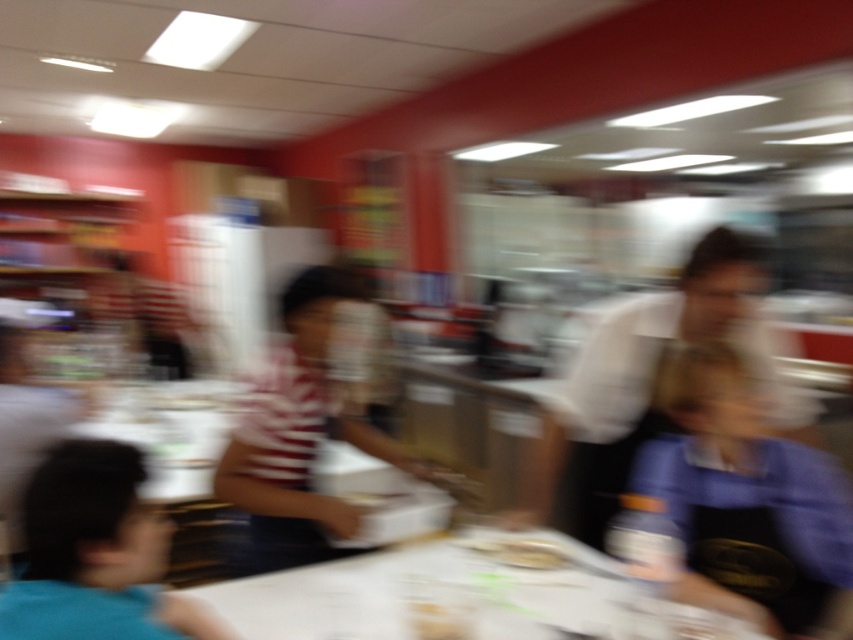
Which of these two, blue fabric shirt at right or white matte shirt at center, stands taller?

white matte shirt at center is taller.

Is blue fabric shirt at right behind white matte shirt at center?

No, blue fabric shirt at right is closer to the viewer.

What do you see at coordinates (737, 508) in the screenshot? This screenshot has width=853, height=640. I see `blue fabric shirt at right` at bounding box center [737, 508].

You are a GUI agent. You are given a task and a screenshot of the screen. Output one action in this format:
    pyautogui.click(x=<x>, y=<y>)
    Task: Click on the blue fabric shirt at right
    
    Given the screenshot: What is the action you would take?
    pyautogui.click(x=737, y=508)

Which of these two, blue fabric shirt at right or white striped shirt at center, stands taller?

white striped shirt at center is taller.

Which is more to the left, blue fabric shirt at right or white striped shirt at center?

white striped shirt at center is more to the left.

Is point (811, 531) positioned in front of point (253, 397)?

Yes, point (811, 531) is in front of point (253, 397).

Locate an element on the screen. The image size is (853, 640). blue fabric shirt at right is located at coordinates (737, 508).

Is white matte shirt at center to the left of smooth white plate at center from the viewer's perspective?

Incorrect, white matte shirt at center is not on the left side of smooth white plate at center.

Who is higher up, white matte shirt at center or smooth white plate at center?

white matte shirt at center

The width and height of the screenshot is (853, 640). What do you see at coordinates (659, 368) in the screenshot?
I see `white matte shirt at center` at bounding box center [659, 368].

At what (x,y) coordinates should I click in order to perform the action: click on white matte shirt at center. Please return your answer as a coordinate pair (x, y). Looking at the image, I should click on (659, 368).